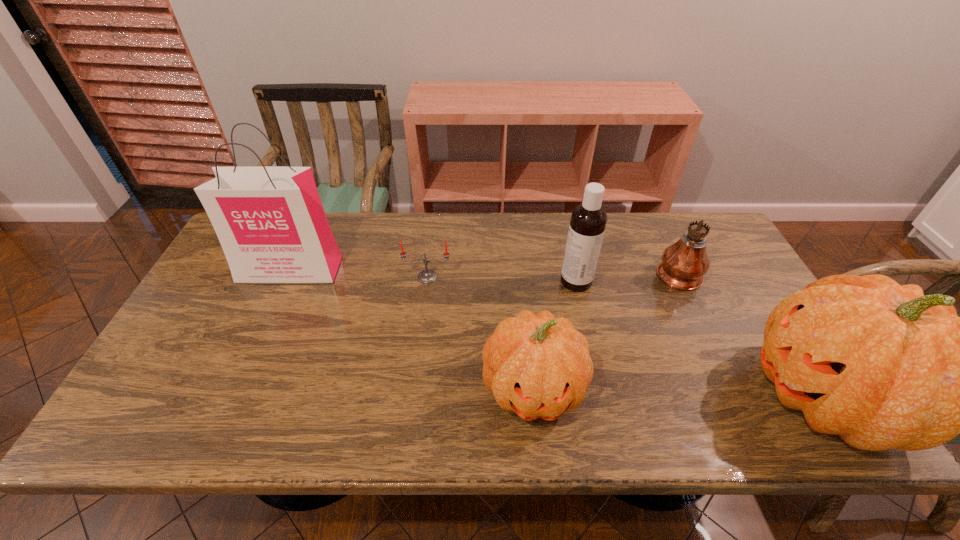
Please point a spot to add another pumpkin on the left. Please provide its 2D coordinates. Your answer should be formatted as a tuple, i.e. [(x, y)], where the tuple contains the x and y coordinates of a point satisfying the conditions above.

[(250, 381)]